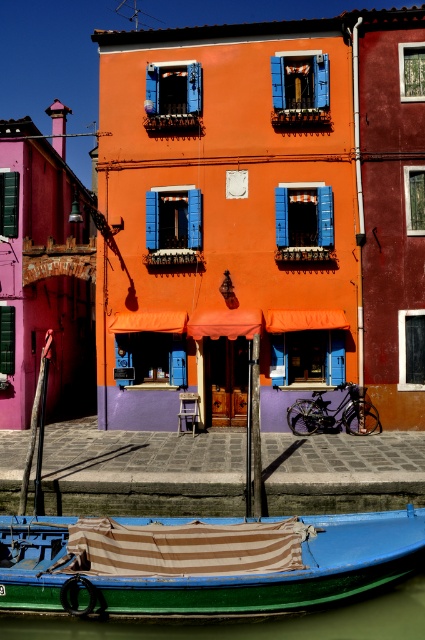
Based on the photo, is green painted wood boat at lower center positioned behind green smooth water at lower left?

No, it is in front of green smooth water at lower left.

Does green painted wood boat at lower center have a lesser height compared to green smooth water at lower left?

No, green painted wood boat at lower center is not shorter than green smooth water at lower left.

Image resolution: width=425 pixels, height=640 pixels. What do you see at coordinates (201, 563) in the screenshot? I see `green painted wood boat at lower center` at bounding box center [201, 563].

The width and height of the screenshot is (425, 640). Find the location of `green painted wood boat at lower center`. green painted wood boat at lower center is located at coordinates (201, 563).